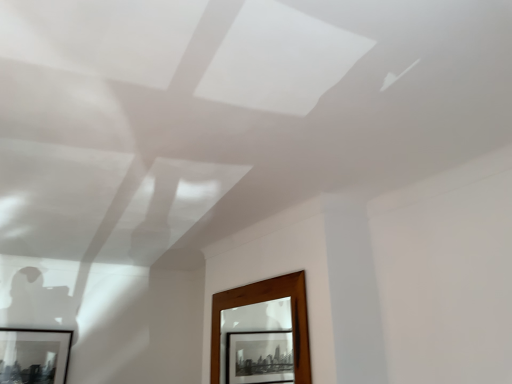
Question: Considering the positions of wooden frame at lower center and black matte picture frame at lower left in the image, is wooden frame at lower center wider or thinner than black matte picture frame at lower left?

Choices:
 (A) thin
 (B) wide

Answer: (A)

Question: Would you say wooden frame at lower center is inside or outside black matte picture frame at lower left?

Choices:
 (A) outside
 (B) inside

Answer: (A)

Question: From a real-world perspective, is wooden frame at lower center physically located above or below black matte picture frame at lower left?

Choices:
 (A) above
 (B) below

Answer: (A)

Question: From a real-world perspective, is black matte picture frame at lower left positioned above or below wooden frame at lower center?

Choices:
 (A) below
 (B) above

Answer: (A)

Question: Based on their sizes in the image, would you say black matte picture frame at lower left is bigger or smaller than wooden frame at lower center?

Choices:
 (A) big
 (B) small

Answer: (B)

Question: Is black matte picture frame at lower left inside the boundaries of wooden frame at lower center, or outside?

Choices:
 (A) inside
 (B) outside

Answer: (B)

Question: Is point (37, 380) positioned closer to the camera than point (233, 344)?

Choices:
 (A) farther
 (B) closer

Answer: (B)